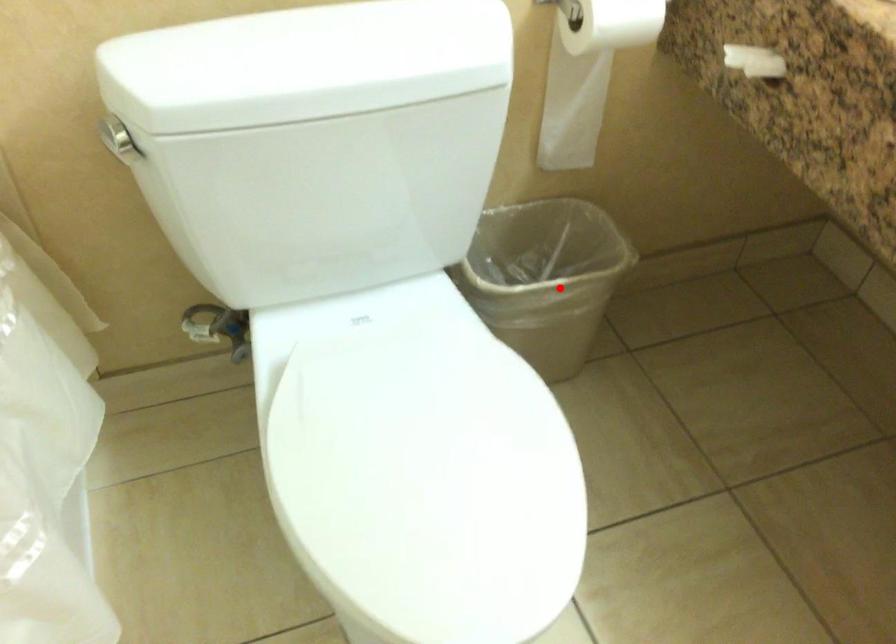
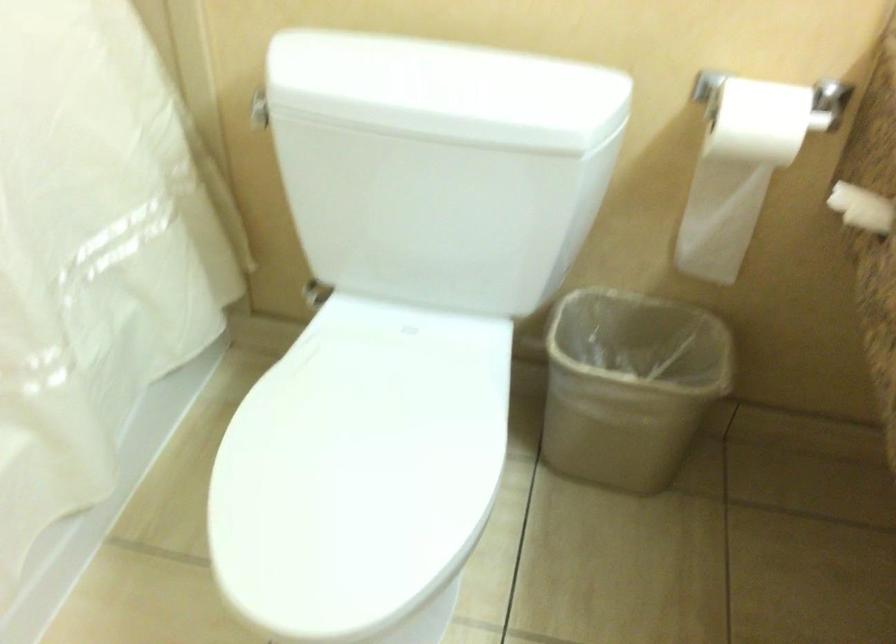
Locate, in the second image, the point that corresponds to the highlighted location in the first image.

(629, 384)